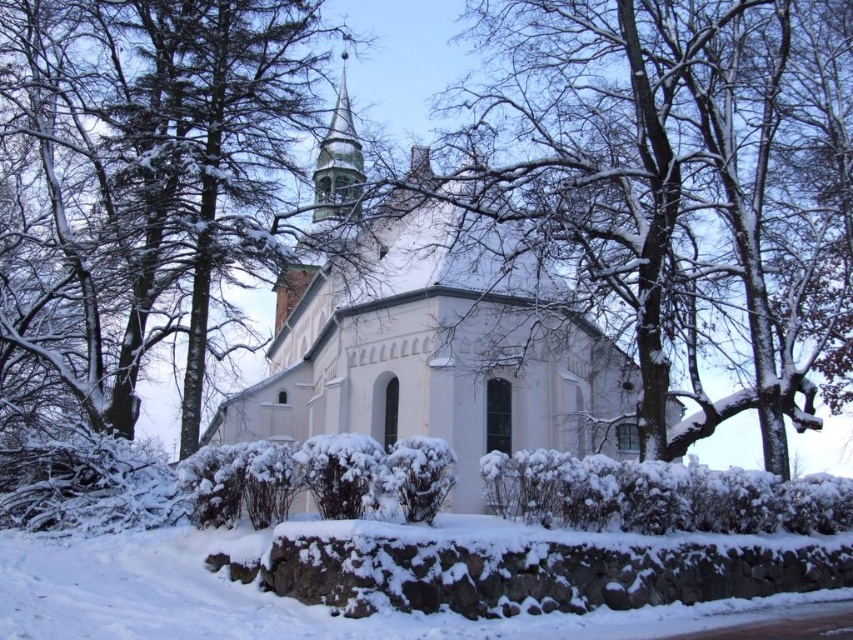
Question: Does snow-covered pine tree at left have a larger size compared to white stone church at center?

Choices:
 (A) yes
 (B) no

Answer: (B)

Question: Is white stone church at center closer to camera compared to snow-covered bark at center?

Choices:
 (A) no
 (B) yes

Answer: (B)

Question: Can you confirm if white stone church at center is positioned above snow-covered bark at center?

Choices:
 (A) no
 (B) yes

Answer: (A)

Question: Which point appears closest to the camera in this image?

Choices:
 (A) (837, 456)
 (B) (117, 96)

Answer: (B)

Question: Which of the following is the farthest from the observer?

Choices:
 (A) white stone church at center
 (B) snow-covered pine tree at left

Answer: (B)

Question: Which point appears closest to the camera in this image?

Choices:
 (A) (364, 314)
 (B) (102, 106)
 (C) (790, 442)

Answer: (B)